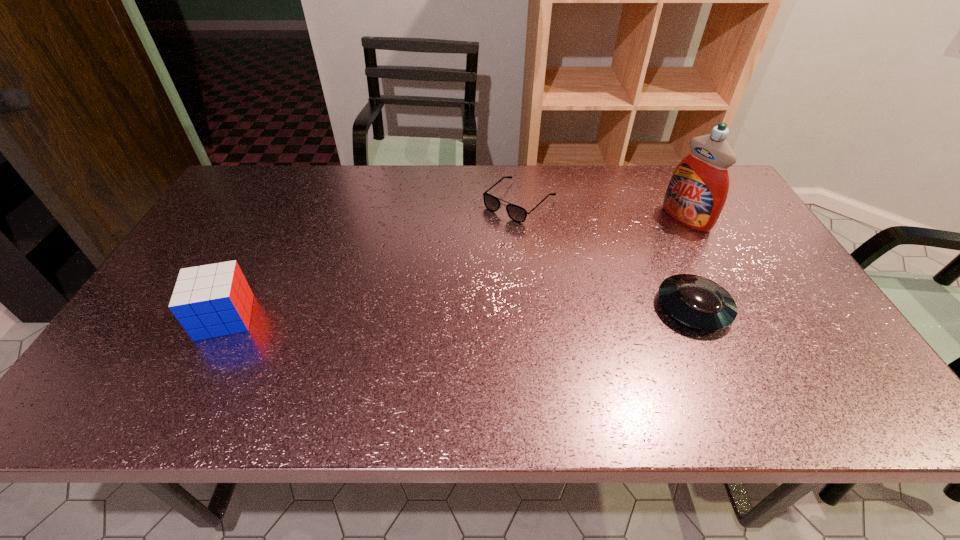
Locate an element on the screen. cube is located at coordinates (213, 300).

Locate an element on the screen. Image resolution: width=960 pixels, height=540 pixels. the third shortest object is located at coordinates (213, 300).

I want to click on saucer, so click(700, 303).

Find the location of a particular element. The image size is (960, 540). spectacles is located at coordinates (518, 214).

Locate an element on the screen. Image resolution: width=960 pixels, height=540 pixels. the tallest object is located at coordinates (696, 194).

The width and height of the screenshot is (960, 540). I want to click on free point located on the right of the leftmost object, so click(330, 317).

This screenshot has width=960, height=540. I want to click on vacant space located on the left of the saucer, so click(x=522, y=308).

At what (x,y) coordinates should I click in order to perform the action: click on free point located on the front-facing side of the second object from left to right. Please return your answer as a coordinate pair (x, y). Looking at the image, I should click on (451, 262).

Locate an element on the screen. This screenshot has width=960, height=540. vacant space located 0.400m on the front-facing side of the second object from left to right is located at coordinates [x=409, y=300].

Locate an element on the screen. Image resolution: width=960 pixels, height=540 pixels. free space located on the front-facing side of the second object from left to right is located at coordinates (414, 295).